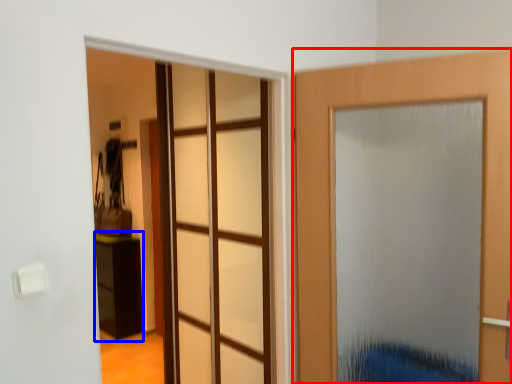
Question: Which of the following is the farthest to the observer, door (highlighted by a red box) or furniture (highlighted by a blue box)?

Choices:
 (A) door
 (B) furniture

Answer: (B)